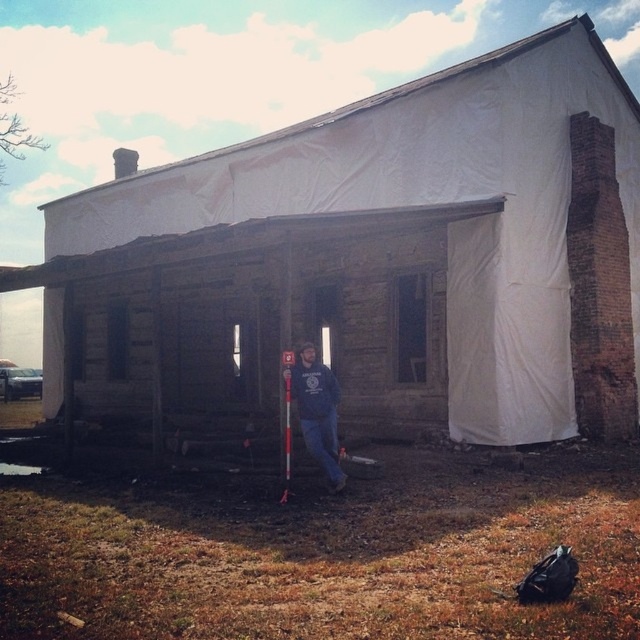
Question: Is wooden hut at center closer to camera compared to red plastic ski pole at center?

Choices:
 (A) no
 (B) yes

Answer: (A)

Question: Which point is farther from the camera taking this photo?

Choices:
 (A) (131, 180)
 (B) (333, 464)

Answer: (A)

Question: Which of the following is the closest to the observer?

Choices:
 (A) wooden hut at center
 (B) blue cotton shirt at center

Answer: (B)

Question: Does blue cotton shirt at center come in front of red plastic ski pole at center?

Choices:
 (A) yes
 (B) no

Answer: (B)

Question: Which is farther from the wooden hut at center?

Choices:
 (A) red plastic ski pole at center
 (B) blue cotton shirt at center

Answer: (A)

Question: Does blue cotton shirt at center have a lesser width compared to red plastic ski pole at center?

Choices:
 (A) yes
 (B) no

Answer: (B)